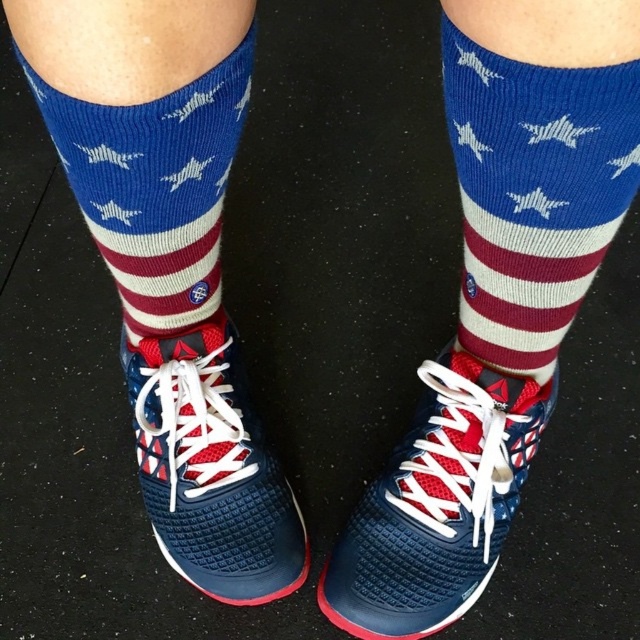
Question: Does blue knitted sock at upper center have a larger size compared to american flag socks at center?

Choices:
 (A) no
 (B) yes

Answer: (B)

Question: Can you confirm if navy blue mesh shoe at center is positioned to the left of navy blue mesh shoe at lower left?

Choices:
 (A) no
 (B) yes

Answer: (A)

Question: Which object is farther from the camera taking this photo?

Choices:
 (A) navy blue mesh shoe at center
 (B) american flag socks at center
 (C) navy blue mesh shoe at lower left
 (D) blue knitted sock at upper center

Answer: (C)

Question: Which point is closer to the camera taking this photo?

Choices:
 (A) (x=262, y=465)
 (B) (x=518, y=420)

Answer: (B)

Question: Which point is farther to the camera?

Choices:
 (A) american flag socks at center
 (B) navy blue mesh shoe at center
 (C) navy blue mesh shoe at lower left
 (D) blue knitted sock at upper center

Answer: (C)

Question: Does blue knitted sock at upper center have a greater width compared to navy blue mesh shoe at center?

Choices:
 (A) yes
 (B) no

Answer: (B)